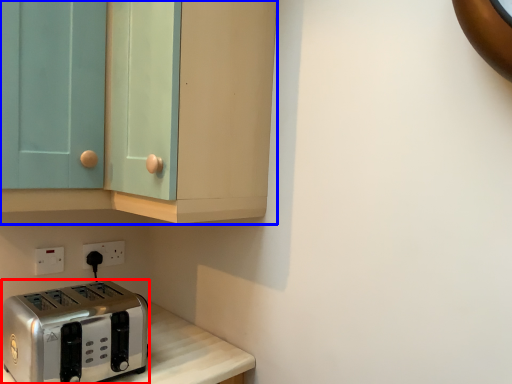
Question: Which point is further to the camera, toaster (highlighted by a red box) or cabinetry (highlighted by a blue box)?

Choices:
 (A) toaster
 (B) cabinetry

Answer: (A)